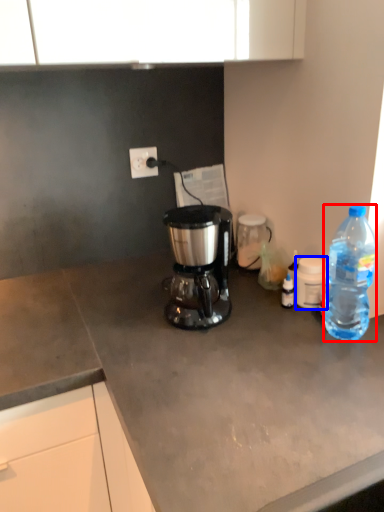
Question: Among these objects, which one is nearest to the camera, bottle (highlighted by a red box) or coffee cup (highlighted by a blue box)?

Choices:
 (A) bottle
 (B) coffee cup

Answer: (A)